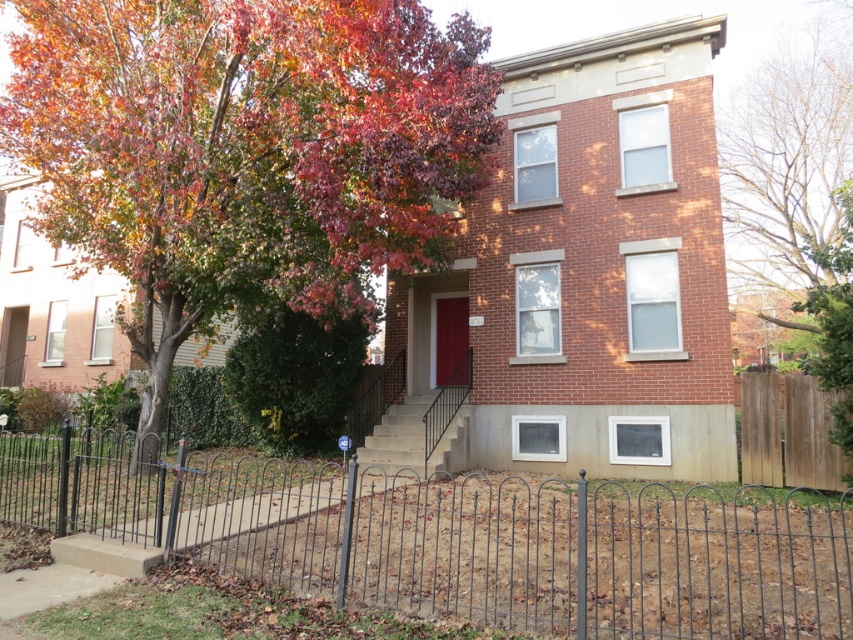
Question: Which object is farther from the camera taking this photo?

Choices:
 (A) black wrought iron fence at center
 (B) bare wood fence at right

Answer: (B)

Question: Is autumn leaves at center positioned in front of black wrought iron fence at center?

Choices:
 (A) yes
 (B) no

Answer: (B)

Question: Among these objects, which one is nearest to the camera?

Choices:
 (A) autumn leaves at center
 (B) black wrought iron fence at center
 (C) bare wood fence at right

Answer: (B)

Question: Can you confirm if black wrought iron fence at center is positioned above bare wood fence at right?

Choices:
 (A) no
 (B) yes

Answer: (A)

Question: Which of the following is the farthest from the observer?

Choices:
 (A) bare wood fence at right
 (B) black wrought iron fence at center

Answer: (A)

Question: Considering the relative positions of autumn leaves at center and bare wood fence at right in the image provided, where is autumn leaves at center located with respect to bare wood fence at right?

Choices:
 (A) below
 (B) above

Answer: (A)